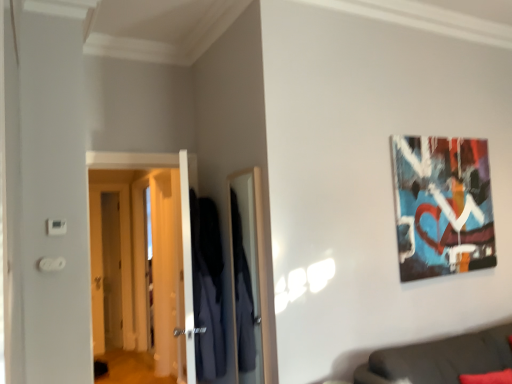
Question: Is abstract painting at upper right directly adjacent to dark gray fabric couch at lower right?

Choices:
 (A) yes
 (B) no

Answer: (B)

Question: Does abstract painting at upper right have a smaller size compared to dark gray fabric couch at lower right?

Choices:
 (A) yes
 (B) no

Answer: (A)

Question: Can you confirm if abstract painting at upper right is wider than dark gray fabric couch at lower right?

Choices:
 (A) yes
 (B) no

Answer: (B)

Question: From the image's perspective, does abstract painting at upper right appear lower than dark gray fabric couch at lower right?

Choices:
 (A) yes
 (B) no

Answer: (B)

Question: Is abstract painting at upper right completely or partially outside of dark gray fabric couch at lower right?

Choices:
 (A) no
 (B) yes

Answer: (B)

Question: Is abstract painting at upper right surrounding dark gray fabric couch at lower right?

Choices:
 (A) yes
 (B) no

Answer: (B)

Question: From a real-world perspective, is abstract painting at upper right positioned under wooden door at left, which is the first door from left to right, based on gravity?

Choices:
 (A) no
 (B) yes

Answer: (A)

Question: Does abstract painting at upper right have a larger size compared to wooden door at left, the 2th door when ordered from right to left?

Choices:
 (A) no
 (B) yes

Answer: (A)

Question: Is wooden door at left, the 2th door viewed from the front, inside abstract painting at upper right?

Choices:
 (A) yes
 (B) no

Answer: (B)

Question: Does abstract painting at upper right have a smaller size compared to wooden door at left, the 2th door when ordered from right to left?

Choices:
 (A) no
 (B) yes

Answer: (B)

Question: Is abstract painting at upper right behind wooden door at left, which is the first door from left to right?

Choices:
 (A) no
 (B) yes

Answer: (A)

Question: Is abstract painting at upper right not within wooden door at left, which is the first door from left to right?

Choices:
 (A) no
 (B) yes

Answer: (B)

Question: Is abstract painting at upper right further to camera compared to white glossy door at left, which appears as the 2th door when viewed from the left?

Choices:
 (A) yes
 (B) no

Answer: (B)